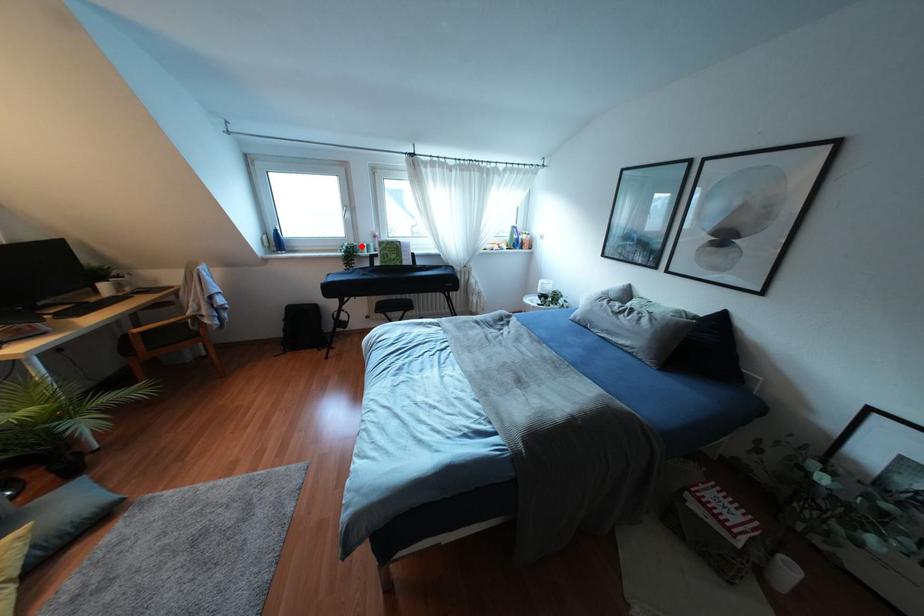
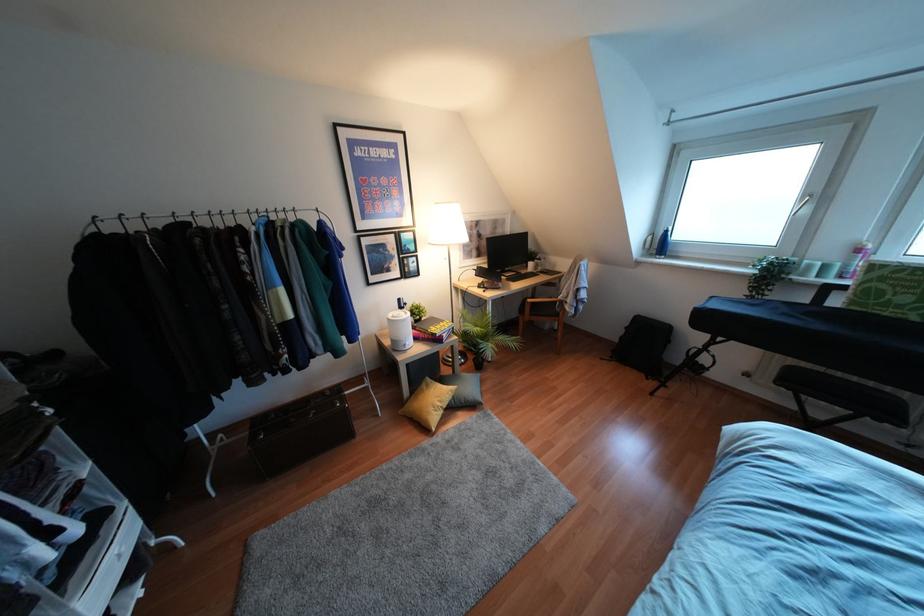
Question: I am providing you with two images of the same scene from different viewpoints. Given a red point in image1, look at the same physical point in image2. Is it:

Choices:
 (A) Closer to the viewpoint
 (B) Farther from the viewpoint

Answer: (B)